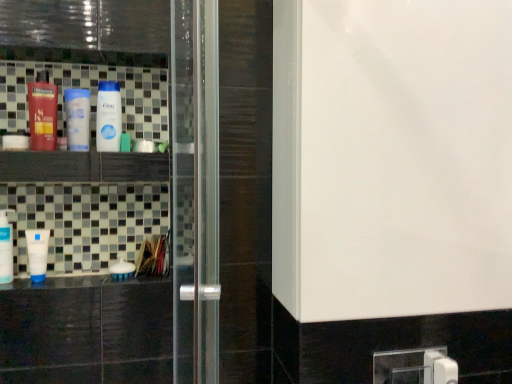
Where is `free spot to the right of white matte tube at lower left, which ranks as the fifth bottle in right-to-left order`? free spot to the right of white matte tube at lower left, which ranks as the fifth bottle in right-to-left order is located at coordinates (87, 277).